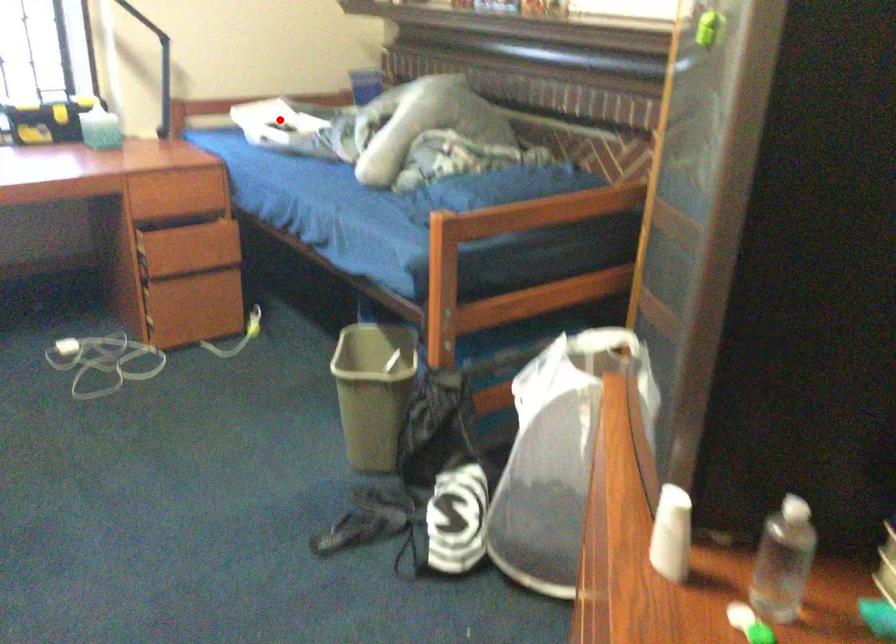
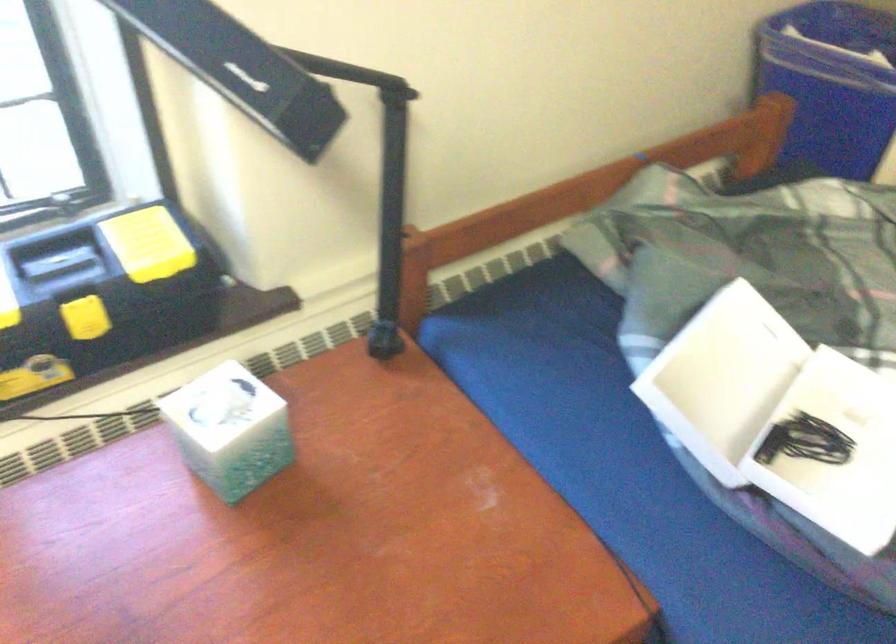
Question: I am providing you with two images of the same scene from different viewpoints. Given a red point in image1, look at the same physical point in image2. Is it:

Choices:
 (A) Closer to the viewpoint
 (B) Farther from the viewpoint

Answer: (A)